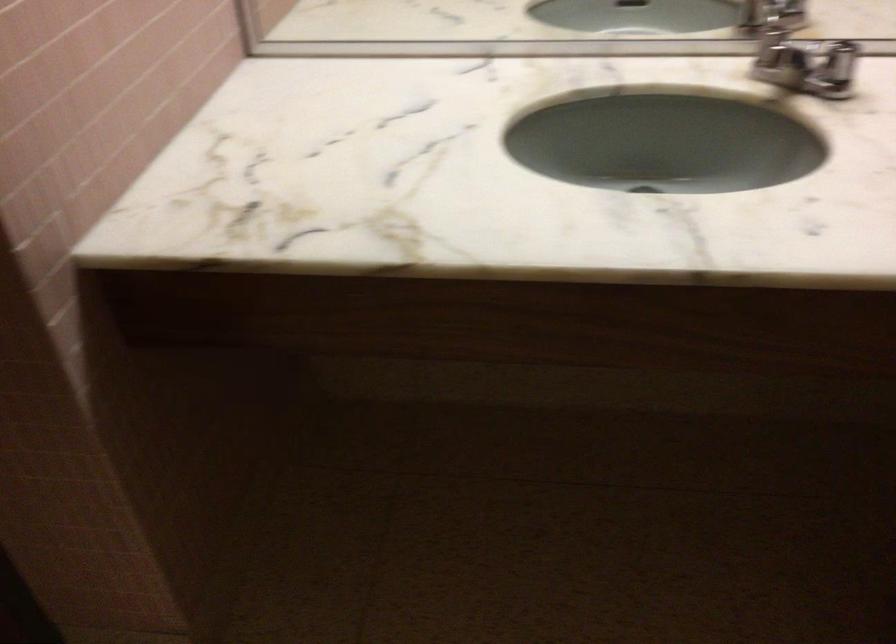
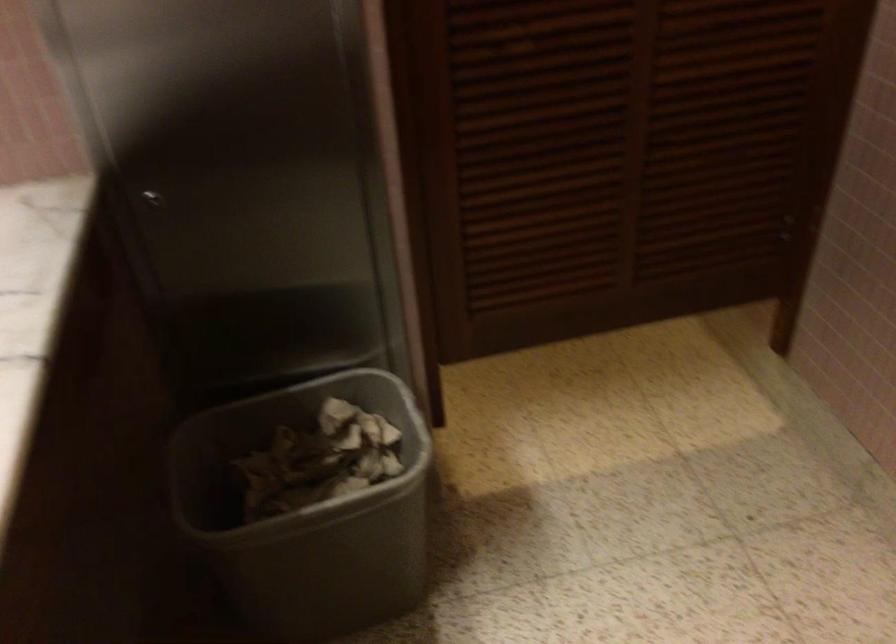
First-person continuous shooting, in which direction is the camera rotating?

The camera rotated toward right-down.